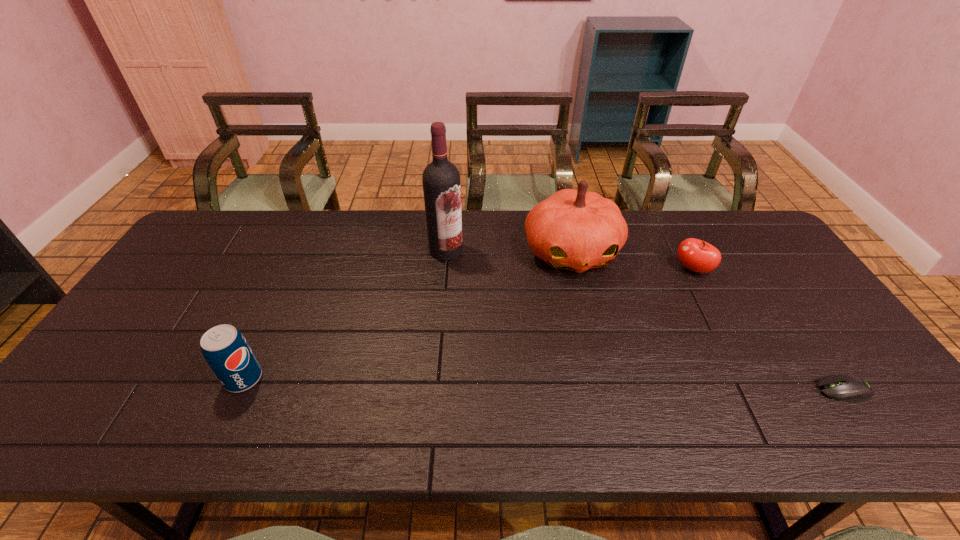
In order to click on empty location between the shortest object and the fourth object from right to left in this screenshot , I will do `click(645, 320)`.

Where is `blank region between the third shortest object and the second object from right to left`? Image resolution: width=960 pixels, height=540 pixels. blank region between the third shortest object and the second object from right to left is located at coordinates (468, 324).

Locate an element on the screen. The image size is (960, 540). empty space between the fourth object from right to left and the leftmost object is located at coordinates (345, 315).

Image resolution: width=960 pixels, height=540 pixels. I want to click on free space between the pumpkin and the computer mouse, so click(708, 321).

Locate which object is the fourth closest to the computer mouse. Please provide its 2D coordinates. Your answer should be formatted as a tuple, i.e. [(x, y)], where the tuple contains the x and y coordinates of a point satisfying the conditions above.

[(225, 349)]

Locate an element on the screen. Image resolution: width=960 pixels, height=540 pixels. object that ranks as the second closest to the third object from right to left is located at coordinates (441, 179).

The image size is (960, 540). In order to click on free space that satisfies the following two spatial constraints: 1. on the front side of the fourth object from left to right; 2. on the left side of the fourth shortest object in this screenshot , I will do `click(575, 269)`.

You are a GUI agent. You are given a task and a screenshot of the screen. Output one action in this format:
    pyautogui.click(x=<x>, y=<y>)
    Task: Click on the free space that satisfies the following two spatial constraints: 1. on the front side of the computer mouse; 2. on the wheel side of the leftmost object
    Image resolution: width=960 pixels, height=540 pixels.
    Given the screenshot: What is the action you would take?
    pyautogui.click(x=238, y=390)

Locate an element on the screen. free space in the image that satisfies the following two spatial constraints: 1. on the back side of the fourth object from right to left; 2. on the right side of the pop is located at coordinates (302, 251).